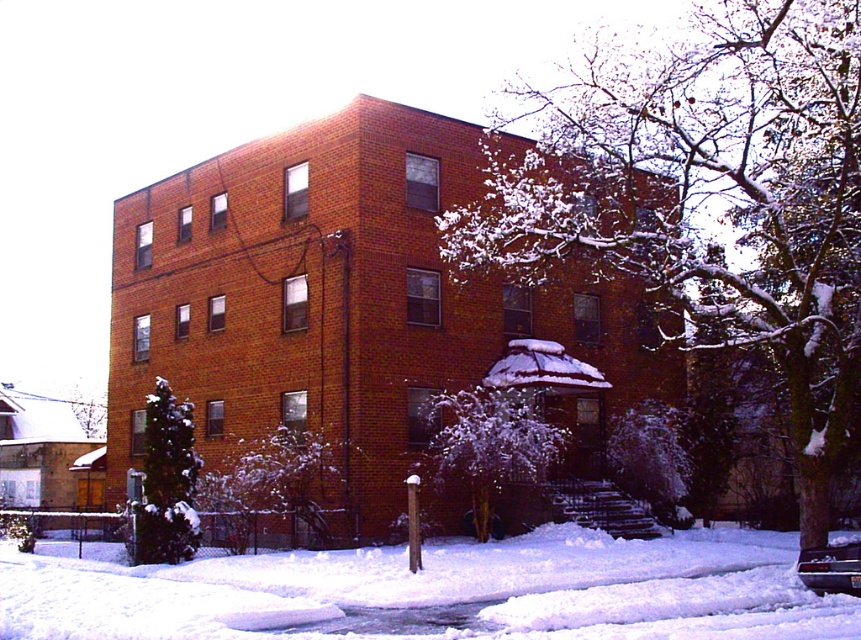
Question: In this image, where is white snow-covered tree at center located relative to green leafy tree at lower left?

Choices:
 (A) right
 (B) left

Answer: (A)

Question: Observing the image, what is the correct spatial positioning of snow-covered branches at center in reference to green matte evergreen tree at lower left?

Choices:
 (A) above
 (B) below

Answer: (A)

Question: In this image, where is white fluffy snow at lower center located relative to green matte evergreen tree at lower left?

Choices:
 (A) below
 (B) above

Answer: (A)

Question: Estimate the real-world distances between objects in this image. Which object is farther from the green leafy tree at lower left?

Choices:
 (A) white snow-covered tree at center
 (B) green matte evergreen tree at lower left

Answer: (B)

Question: Estimate the real-world distances between objects in this image. Which object is farther from the green matte evergreen tree at lower left?

Choices:
 (A) green leafy tree at lower left
 (B) white fluffy snow at lower center
 (C) snow-covered branches at center

Answer: (A)

Question: Which object appears farthest from the camera in this image?

Choices:
 (A) green matte evergreen tree at lower left
 (B) white fluffy snow at lower center

Answer: (A)